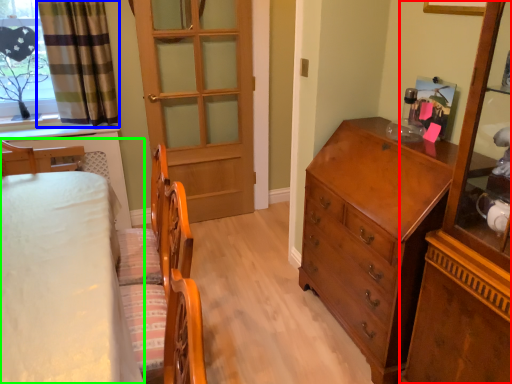
Question: Estimate the real-world distances between objects in this image. Which object is farther from cabinetry (highlighted by a red box), curtain (highlighted by a blue box) or bed (highlighted by a green box)?

Choices:
 (A) curtain
 (B) bed

Answer: (A)